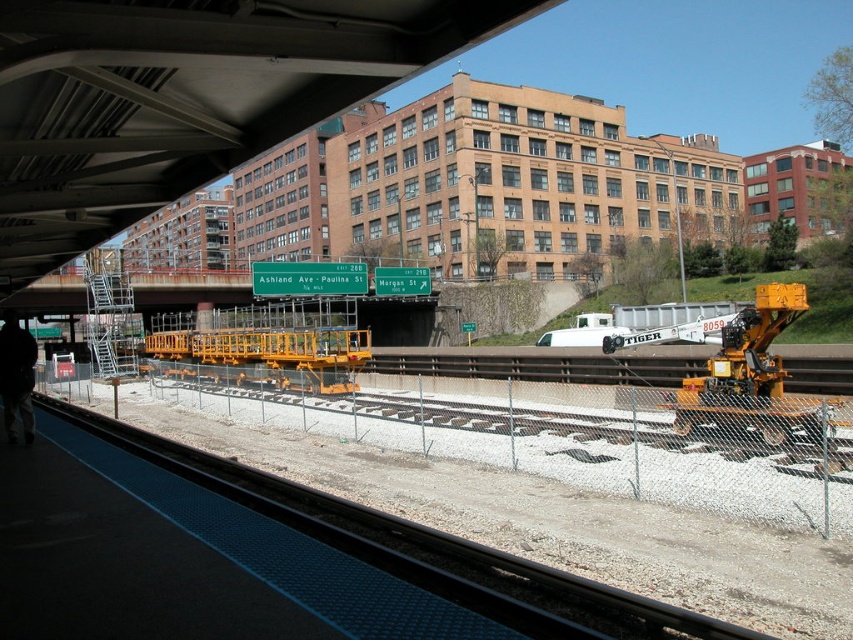
You are a visually impaired person using a cane to navigate the platform. You feel the smooth concrete train track at lower center and the black fabric at lower left. Which surface is larger in size?

The smooth concrete train track at lower center is bigger than the black fabric at lower left, so the smooth concrete train track at lower center is larger in size.

You are a railway inspector standing on the platform. You need to check the condition of the smooth concrete train track at lower center and the yellow metallic crane at right. Which object is closer to the platform edge marked by the blue tactile paving strip?

The smooth concrete train track at lower center is located below the yellow metallic crane at right, meaning it is closer to the platform edge marked by the blue tactile paving strip.

Looking at this image, you are a maintenance worker on the platform. You need to access the smooth concrete train track at lower center. Is the black fabric at lower left blocking your path to it?

The smooth concrete train track at lower center is below the black fabric at lower left, so the black fabric at lower left is blocking the path to it.